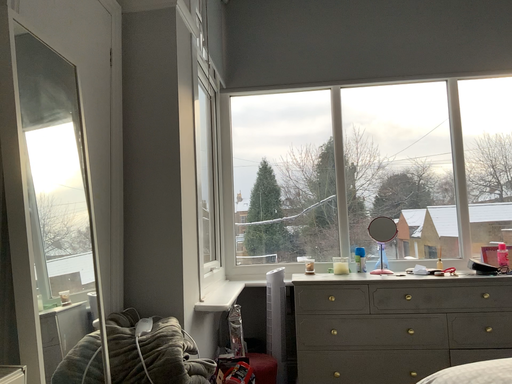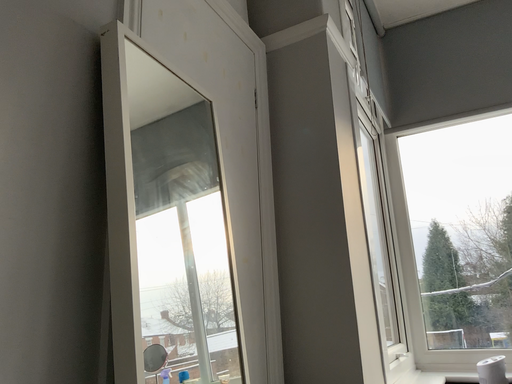
Question: Which way did the camera rotate in the video?

Choices:
 (A) rotated downward
 (B) rotated upward

Answer: (B)